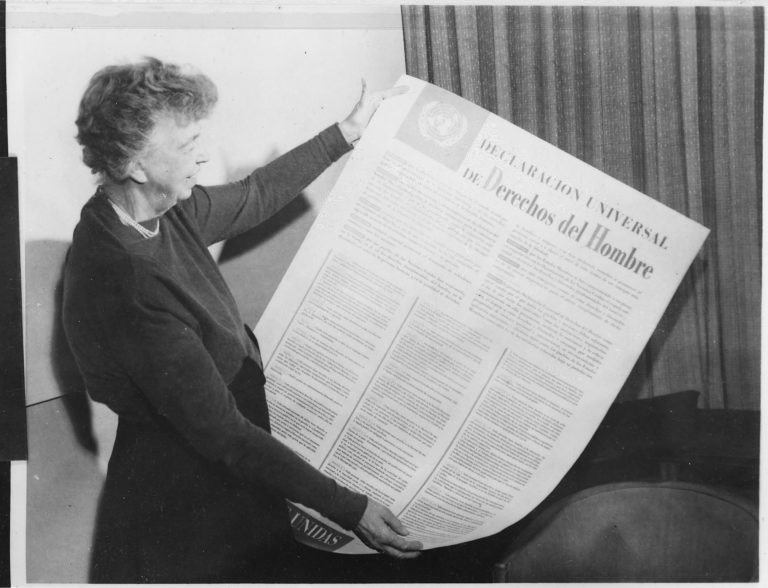
The image size is (768, 588). What are the coordinates of `dark gray chair` in the screenshot? It's located at (630, 549).